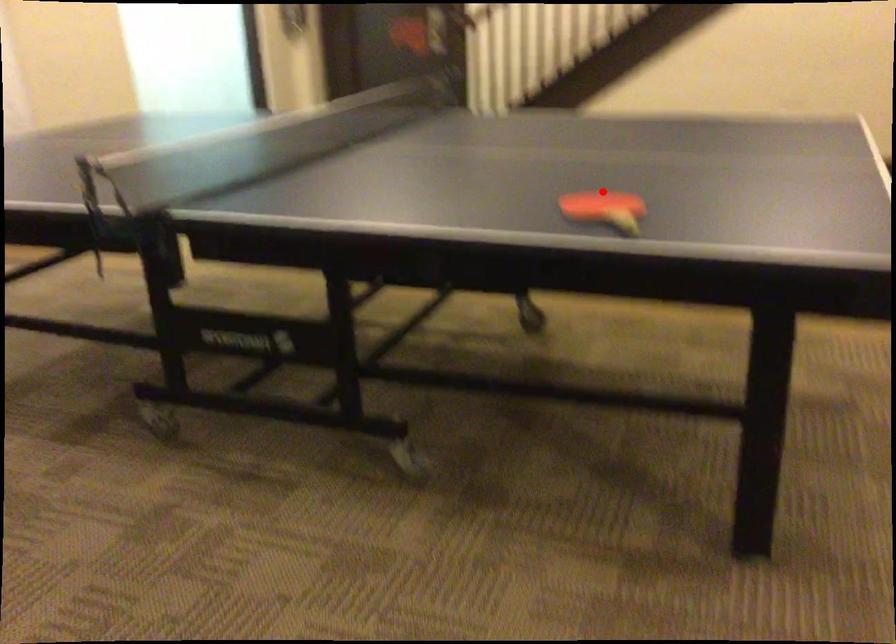
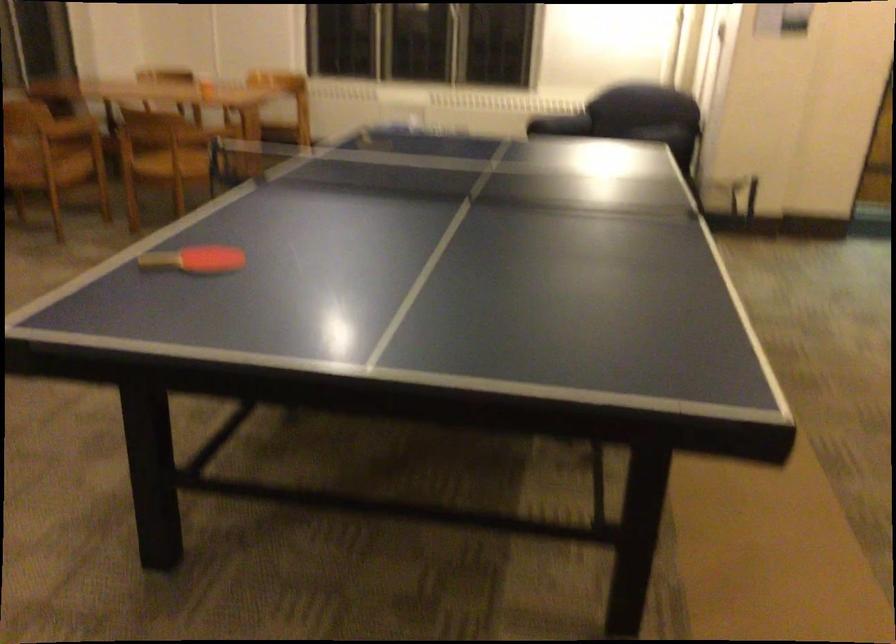
Locate, in the second image, the point that corresponds to the highlighted location in the first image.

(194, 259)